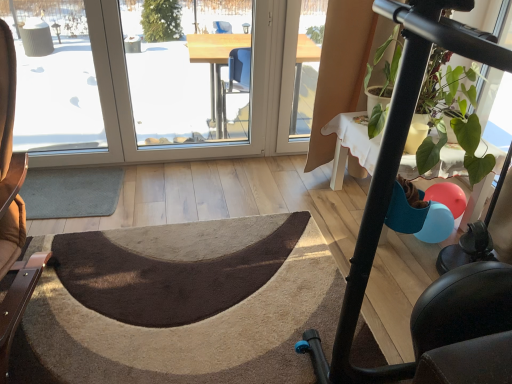
Question: Considering the positions of gray carpet at lower left, the second doormat ordered from the bottom, and transparent glass window at upper left, the 1th window screen viewed from the left, in the image, is gray carpet at lower left, the second doormat ordered from the bottom, bigger or smaller than transparent glass window at upper left, the 1th window screen viewed from the left,?

Choices:
 (A) big
 (B) small

Answer: (B)

Question: Looking at their shapes, would you say gray carpet at lower left, which is the first doormat in top-to-bottom order, is wider or thinner than transparent glass window at upper left, the 1th window screen viewed from the left?

Choices:
 (A) wide
 (B) thin

Answer: (A)

Question: Considering the real-world distances, which object is closest to the transparent glass window at center, marked as the 1th window screen in a right-to-left arrangement?

Choices:
 (A) white lace tablecloth at upper right
 (B) transparent glass window at upper left, the 1th window screen viewed from the left
 (C) green matte plant at right
 (D) gray carpet at lower left, the second doormat ordered from the bottom
 (E) brown textured rug at center, which appears as the 2th doormat when viewed from the top

Answer: (B)

Question: Based on their relative distances, which object is nearer to the transparent glass window at upper left, the second window screen positioned from the right?

Choices:
 (A) white lace tablecloth at upper right
 (B) brown leather chair at left
 (C) brown textured rug at center, which appears as the 2th doormat when viewed from the top
 (D) green matte plant at right
 (E) transparent glass window at center, marked as the second window screen in a left-to-right arrangement

Answer: (B)